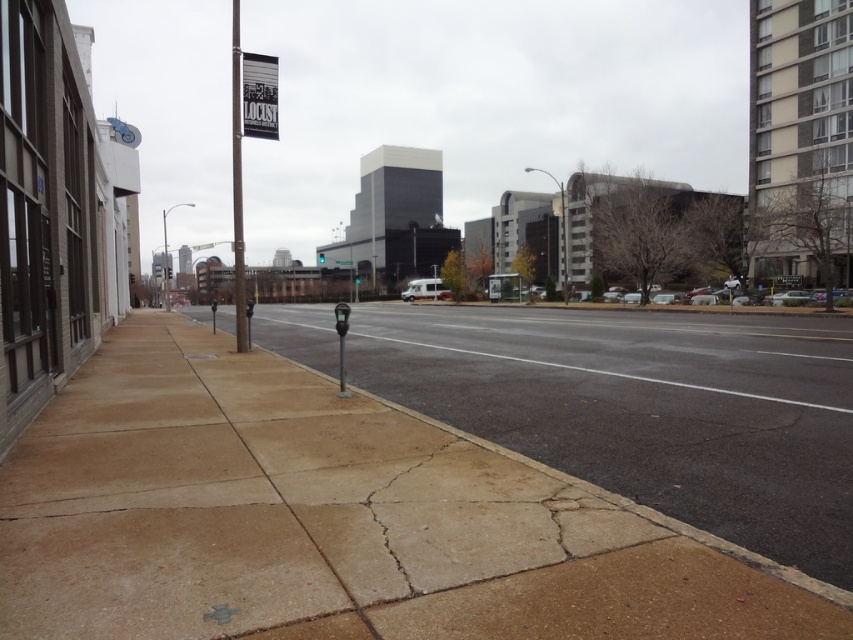
You are a delivery person who needs to place a box between the metallic gray parking meter at lower left and the green plastic street sign at center. Can the box fit horizontally if the box is as wide as the parking meter?

The metallic gray parking meter at lower left is narrower than the green plastic street sign at center. Since the box is as wide as the parking meter, it should fit horizontally between them as long as the distance between them is sufficient.

You are a delivery person trying to park your matte white van at center near the brown concrete sidewalk at lower left. Can you park the van so that it fits entirely on the sidewalk?

The brown concrete sidewalk at lower left is positioned on the left side of matte white van at center. However, sidewalks are typically meant for pedestrians and not for parking vehicles. The van would likely be too large to fit entirely on the narrow sidewalk and parking there would block pedestrian access, so it is not advisable to park the matte white van at center there.